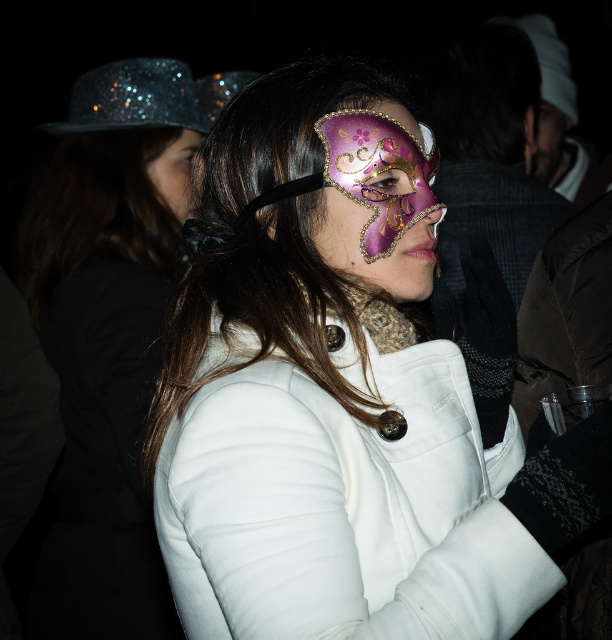
Question: Does purple glossy mask at center lie in front of glittery sequined hat at upper left?

Choices:
 (A) yes
 (B) no

Answer: (A)

Question: Which object is closer to the camera taking this photo?

Choices:
 (A) glittery sequined hat at upper left
 (B) matte purple mask at center
 (C) purple glossy mask at center

Answer: (B)

Question: Is matte purple mask at center to the left of glittery sequined hat at upper left from the viewer's perspective?

Choices:
 (A) no
 (B) yes

Answer: (A)

Question: Which object is positioned closest to the matte purple mask at center?

Choices:
 (A) purple glossy mask at center
 (B) matte black hair at upper left

Answer: (A)

Question: Estimate the real-world distances between objects in this image. Which object is farther from the matte black hair at upper left?

Choices:
 (A) purple glossy mask at center
 (B) matte white coat at center
 (C) matte purple mask at center

Answer: (C)

Question: Can you confirm if matte purple mask at center is positioned to the right of matte white coat at center?

Choices:
 (A) yes
 (B) no

Answer: (A)